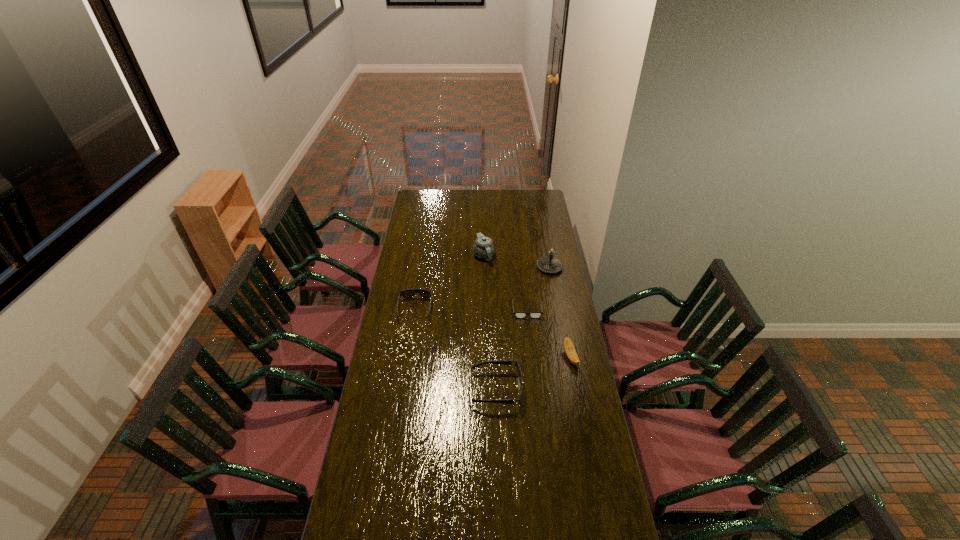
Identify the location of free spot between the chinaware and the leftmost object. tap(449, 282).

I want to click on vacant area that lies between the spectacles and the leftmost object, so click(x=471, y=310).

You are a GUI agent. You are given a task and a screenshot of the screen. Output one action in this format:
    pyautogui.click(x=<x>, y=<y>)
    Task: Click on the empty space between the shortest object and the taller sunglasses
    Image resolution: width=960 pixels, height=540 pixels.
    Given the screenshot: What is the action you would take?
    pyautogui.click(x=512, y=349)

Identify the location of free space between the chinaware and the spectacles. (506, 283).

Find the location of a particular element. object identified as the second closest to the chinaware is located at coordinates (517, 314).

The image size is (960, 540). In order to click on object that is the fifth nearest to the third tallest object in this screenshot , I will do `click(483, 248)`.

Identify the location of free space that satisfies the following two spatial constraints: 1. on the front-facing side of the shortest object; 2. on the front-facing side of the right sunglasses. The height and width of the screenshot is (540, 960). (536, 389).

Locate an element on the screen. This screenshot has width=960, height=540. free region that satisfies the following two spatial constraints: 1. from the spout of the chinaware; 2. on the right side of the banana is located at coordinates (485, 357).

Where is `free space in the image that satisfies the following two spatial constraints: 1. on the front-facing side of the spectacles; 2. on the left side of the third tallest object`? This screenshot has height=540, width=960. free space in the image that satisfies the following two spatial constraints: 1. on the front-facing side of the spectacles; 2. on the left side of the third tallest object is located at coordinates (532, 357).

Find the location of `vacant area that satisfies the following two spatial constraints: 1. from the spout of the candle; 2. on the left side of the chinaware`. vacant area that satisfies the following two spatial constraints: 1. from the spout of the candle; 2. on the left side of the chinaware is located at coordinates (484, 267).